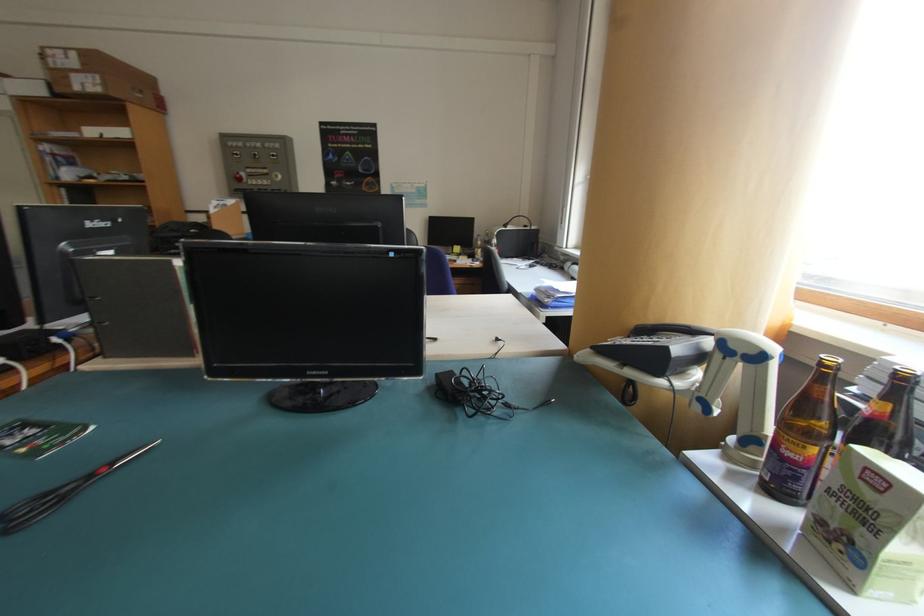
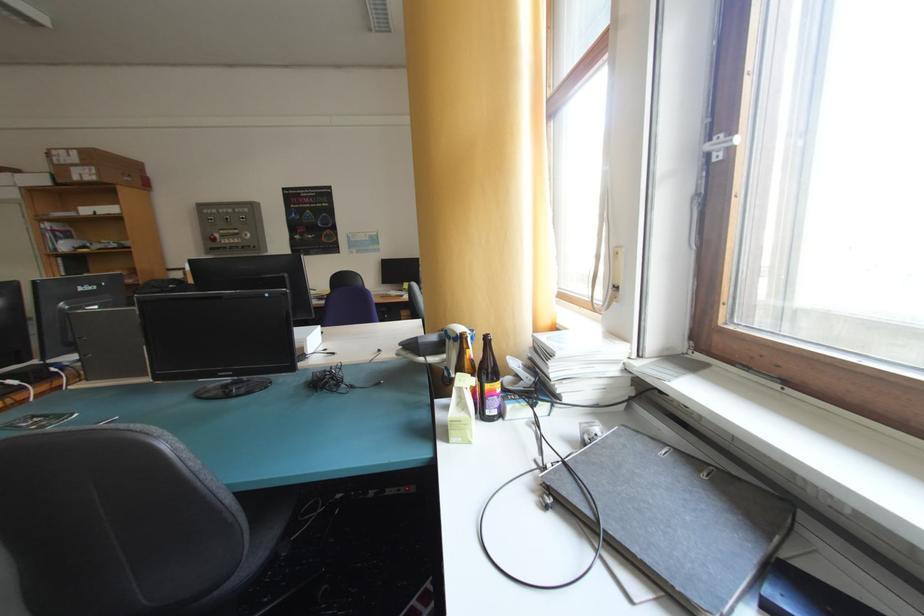
The point at (742,347) is marked in the first image. Where is the corresponding point in the second image?

(457, 334)